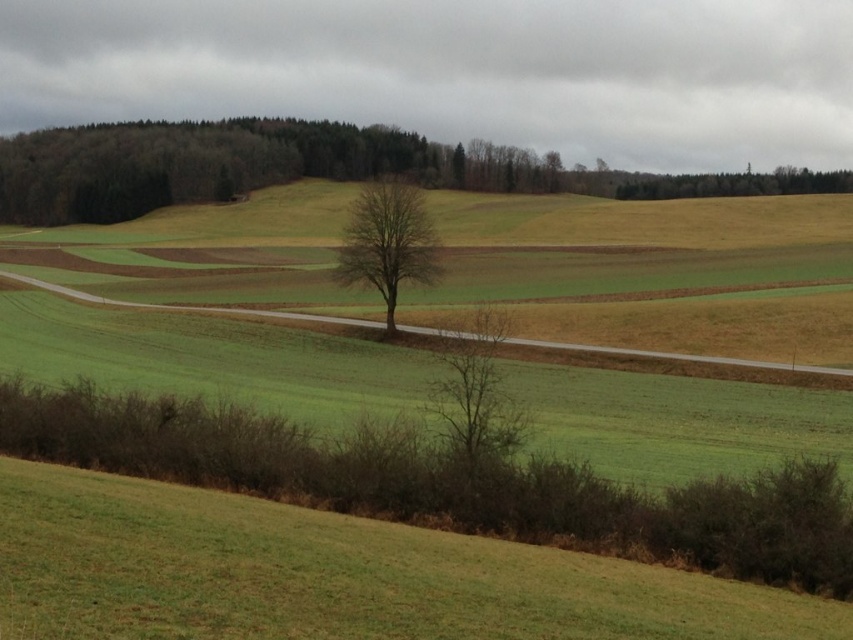
You are a hiker standing at the base of the bare brown tree at center. You want to walk towards the bare tree at upper center. Which direction should you head?

The bare tree at upper center is to the right of the bare brown tree at center, so you should head to the right.

You are a bird looking for a place to perch. You see the bare branches at center and the green leafy tree at upper right. Which tree is shorter and better for a small bird like you?

The bare branches at center is shorter than the green leafy tree at upper right, making it a better option for a small bird.

You are a hiker who wants to take a photo of the bare branches at center and the green leafy tree at upper right together in the same frame. Based on their distance apart, do you think you can capture both in one shot without moving your camera position?

The bare branches at center is 254.13 meters away from the green leafy tree at upper right. Since this distance is quite large, it might be challenging to capture both in a single frame without moving the camera. However, using a wide angle lens could potentially include both subjects in the shot.